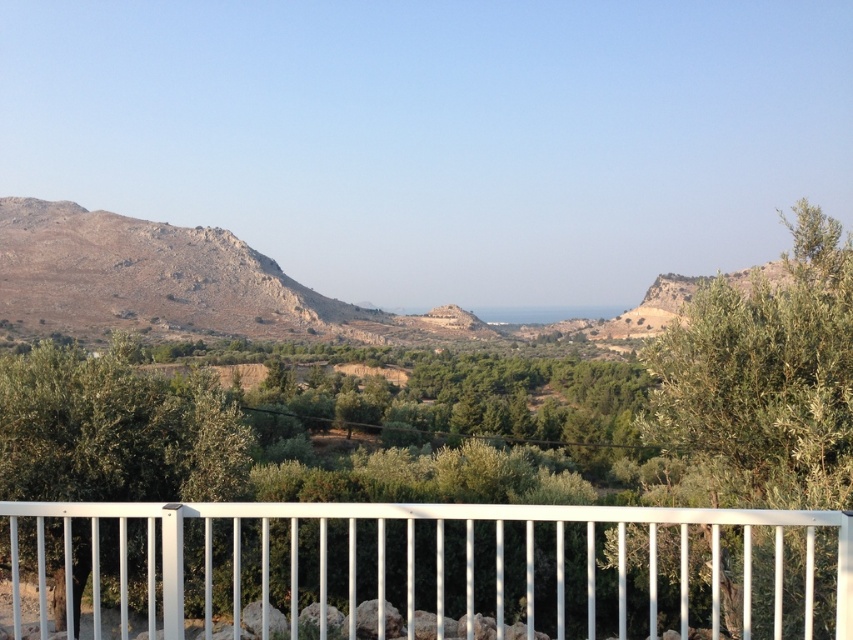
Can you confirm if white metal railing at lower center is smaller than green leafy olive tree at lower left?

No.

Is point (664, 621) closer to camera compared to point (177, 451)?

That is False.

The width and height of the screenshot is (853, 640). Describe the element at coordinates (428, 570) in the screenshot. I see `white metal railing at lower center` at that location.

Locate an element on the screen. The width and height of the screenshot is (853, 640). white metal railing at lower center is located at coordinates (428, 570).

Is brown rocky mountain at center to the left of green leafy olive tree at lower left from the viewer's perspective?

Incorrect, brown rocky mountain at center is not on the left side of green leafy olive tree at lower left.

Does point (47, 301) come behind point (0, 492)?

Yes.

Image resolution: width=853 pixels, height=640 pixels. What do you see at coordinates (222, 288) in the screenshot?
I see `brown rocky mountain at center` at bounding box center [222, 288].

In order to click on brown rocky mountain at center in this screenshot , I will do `click(222, 288)`.

How distant is green leafy tree at right from brown rocky mountain at center?

green leafy tree at right and brown rocky mountain at center are 67.00 meters apart.

Does green leafy tree at right have a lesser height compared to brown rocky mountain at center?

Correct, green leafy tree at right is not as tall as brown rocky mountain at center.

This screenshot has height=640, width=853. What are the coordinates of `green leafy tree at right` in the screenshot? It's located at (759, 385).